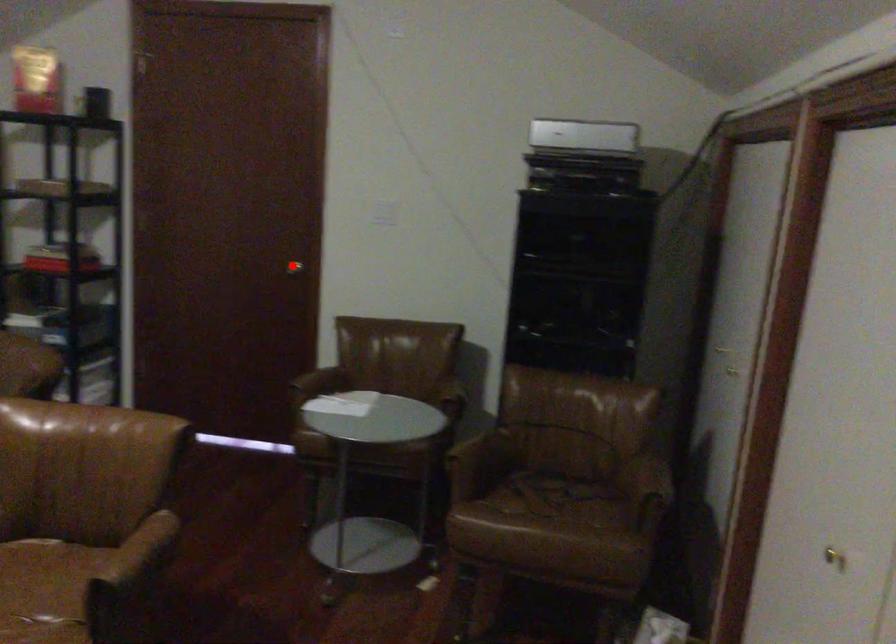
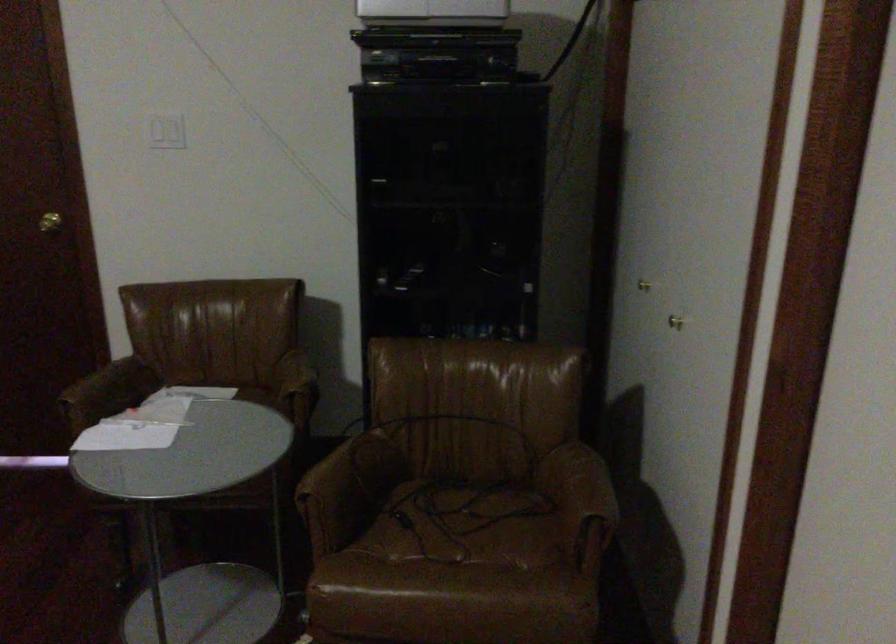
Question: I am providing you with two images of the same scene from different viewpoints. Given a red point in image1, look at the same physical point in image2. Is it:

Choices:
 (A) Closer to the viewpoint
 (B) Farther from the viewpoint

Answer: (A)